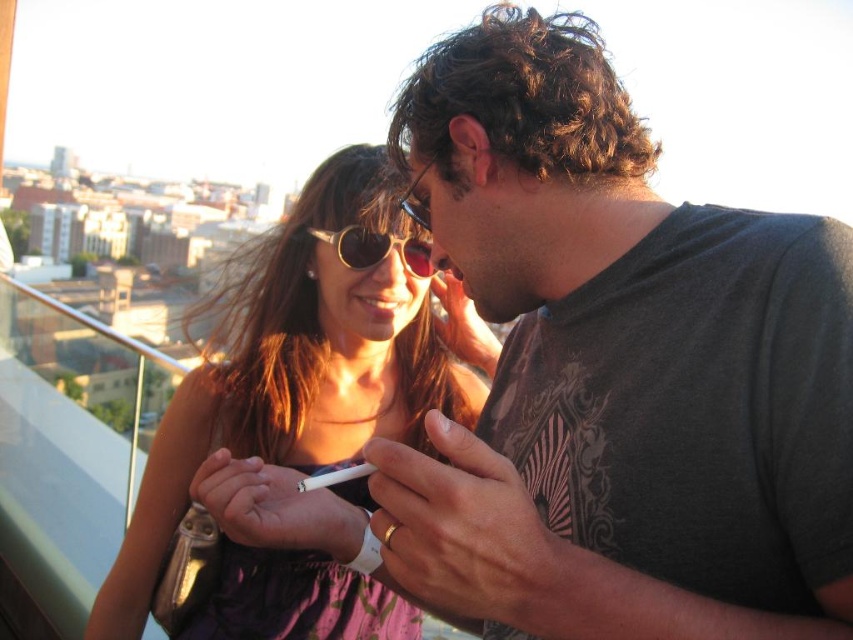
Is dark gray t-shirt at center bigger than sunglasses at center?

Correct, dark gray t-shirt at center is larger in size than sunglasses at center.

In the scene shown: Who is more forward, (564, 376) or (352, 266)?

Point (564, 376) is more forward.

Between point (584, 477) and point (424, 248), which one is positioned behind?

Point (424, 248)

The image size is (853, 640). Identify the location of dark gray t-shirt at center. (619, 371).

Can you confirm if dark gray t-shirt at center is positioned above matte purple dress at center?

Correct, dark gray t-shirt at center is located above matte purple dress at center.

Is point (492, 552) positioned after point (218, 484)?

No, it is in front of (218, 484).

You are a GUI agent. You are given a task and a screenshot of the screen. Output one action in this format:
    pyautogui.click(x=<x>, y=<y>)
    Task: Click on the dark gray t-shirt at center
    The height and width of the screenshot is (640, 853).
    Given the screenshot: What is the action you would take?
    pyautogui.click(x=619, y=371)

Between matte purple dress at center and sunglasses at center, which one is positioned higher?

sunglasses at center is above.

Which is more to the left, matte purple dress at center or sunglasses at center?

matte purple dress at center is more to the left.

Image resolution: width=853 pixels, height=640 pixels. I want to click on matte purple dress at center, so click(299, 428).